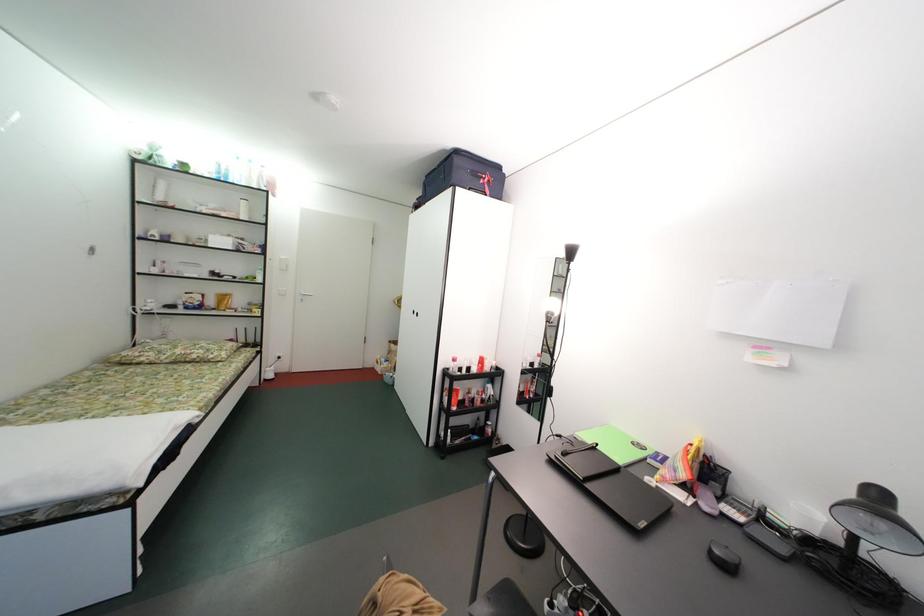
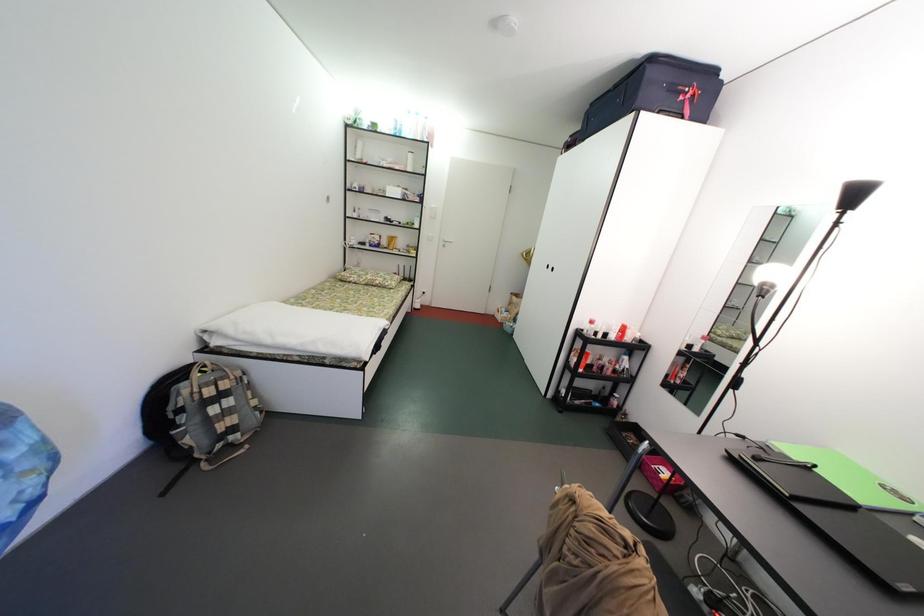
Question: Which direction would the cameraman need to move to produce the second image? Reply with the corresponding letter.

Choices:
 (A) Left
 (B) Right
 (C) Forward
 (D) Backward

Answer: (A)